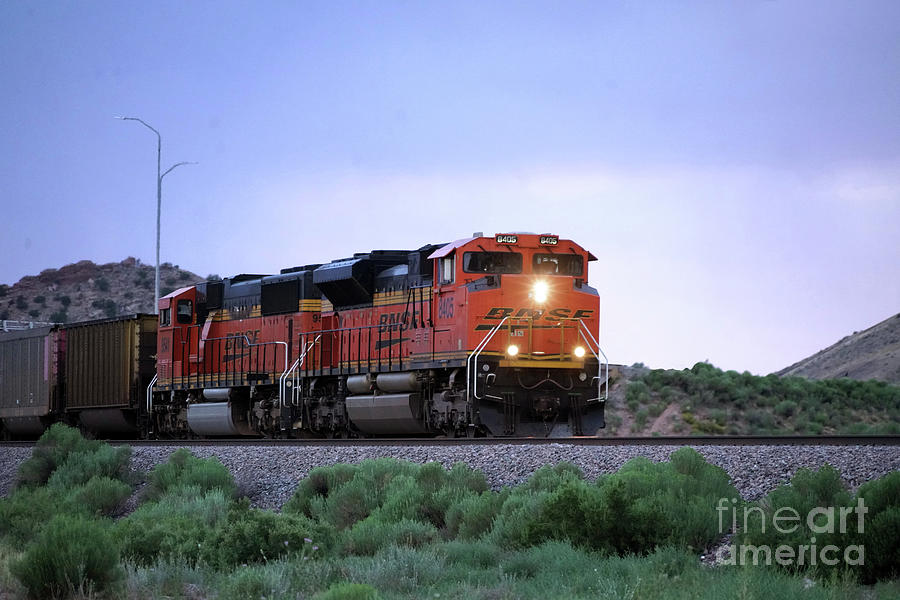
You are a GUI agent. You are given a task and a screenshot of the screen. Output one action in this format:
    pyautogui.click(x=<x>, y=<y>)
    Task: Click on the light
    The width and height of the screenshot is (900, 600).
    Given the screenshot: What is the action you would take?
    pyautogui.click(x=544, y=288), pyautogui.click(x=517, y=347), pyautogui.click(x=577, y=351)